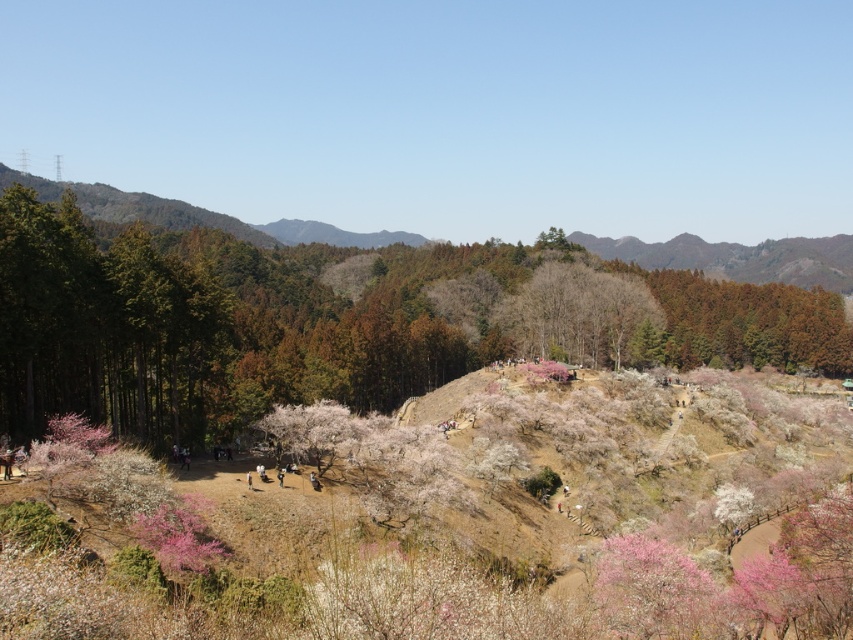
Question: From the image, what is the correct spatial relationship of pink blossoms at center in relation to green leafy forest at left?

Choices:
 (A) below
 (B) above

Answer: (A)

Question: From the image, what is the correct spatial relationship of pink blossoms at center in relation to green leafy forest at left?

Choices:
 (A) above
 (B) below

Answer: (B)

Question: Considering the relative positions of pink blossoms at center and green leafy forest at left in the image provided, where is pink blossoms at center located with respect to green leafy forest at left?

Choices:
 (A) left
 (B) right

Answer: (A)

Question: Which object appears farthest from the camera in this image?

Choices:
 (A) green leafy forest at left
 (B) pink blossoms at center

Answer: (A)

Question: Among these points, which one is farthest from the camera?

Choices:
 (A) (38, 186)
 (B) (817, 323)

Answer: (A)